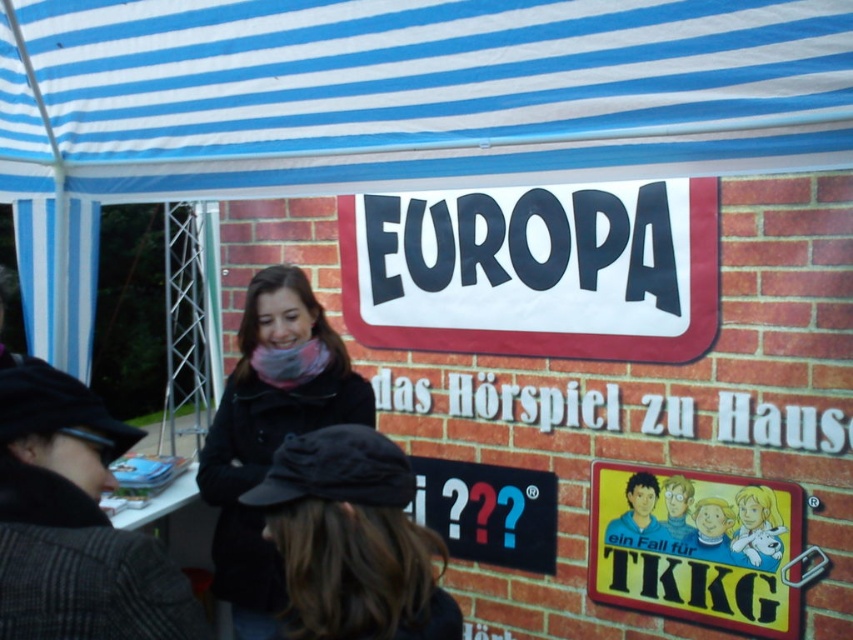
Question: Considering the real-world distances, which object is closest to the yellow cardboard sign at lower right?

Choices:
 (A) black matte coat at center
 (B) blue striped canopy at upper center
 (C) black plastic sign at center
 (D) black fabric cap at center

Answer: (C)

Question: Can you confirm if black plastic sign at center is positioned above yellow cardboard sign at lower right?

Choices:
 (A) yes
 (B) no

Answer: (A)

Question: Does blue striped canopy at upper center have a smaller size compared to black plastic sign at center?

Choices:
 (A) no
 (B) yes

Answer: (A)

Question: Which of the following is the farthest from the observer?

Choices:
 (A) (376, 435)
 (B) (360, 376)

Answer: (B)

Question: Can you confirm if blue striped canopy at upper center is bigger than yellow cardboard sign at lower right?

Choices:
 (A) no
 (B) yes

Answer: (B)

Question: Which object is the closest to the black matte coat at center?

Choices:
 (A) yellow cardboard sign at lower right
 (B) black fabric cap at center
 (C) blue striped canopy at upper center

Answer: (C)